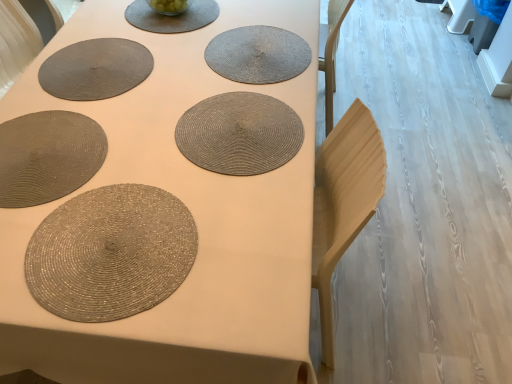
Identify the location of vacant space behind rattan placemat at center, which is the 2th coaster in top-to-bottom order. The image size is (512, 384). (231, 64).